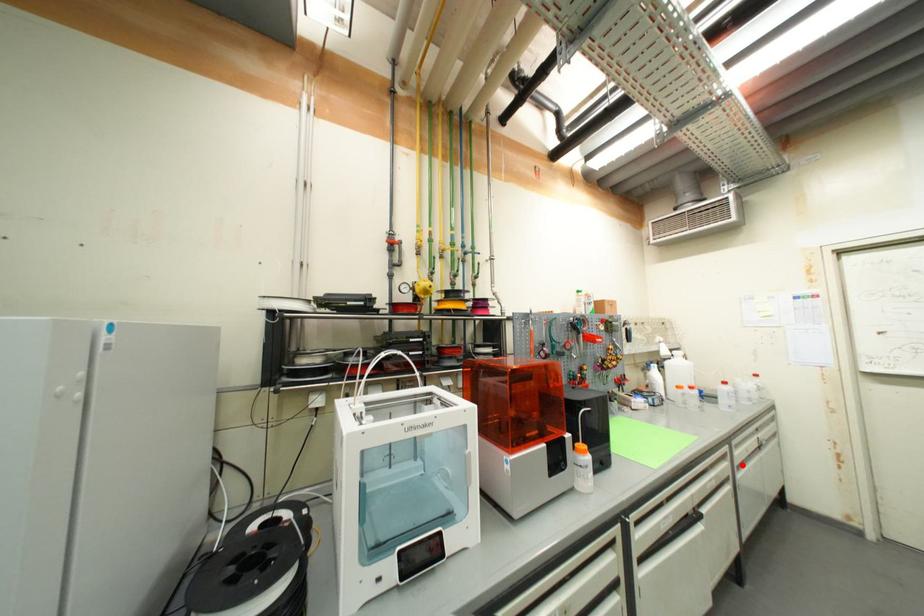
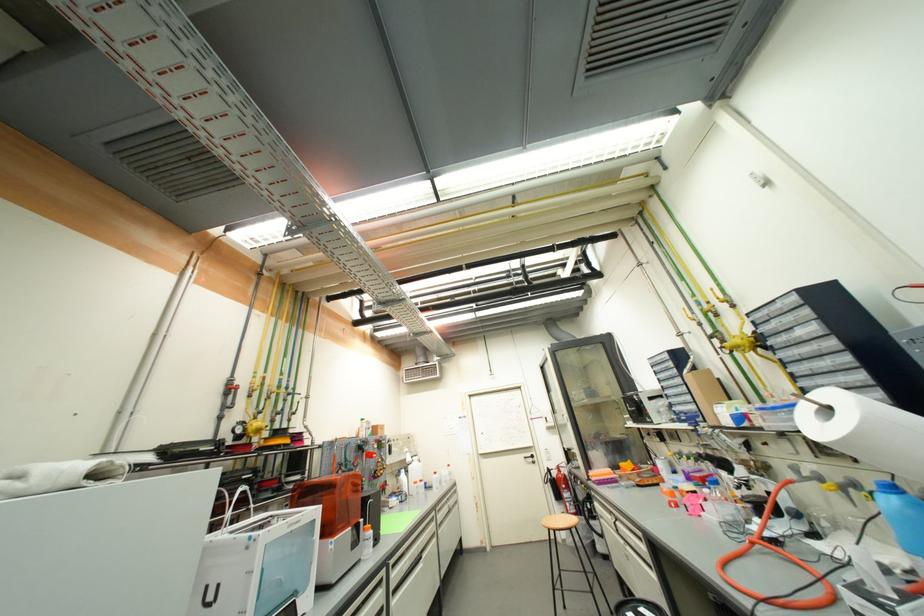
Locate, in the second image, the point that corresponds to the highlighted location in the first image.

(444, 525)